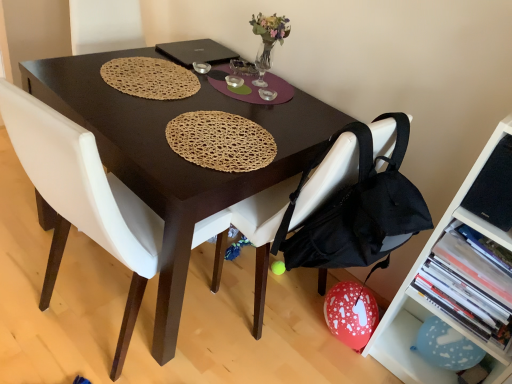
Where is `free region under white leather chair at center, which is the 2th chair in right-to-left order (from a real-world perspective)`? This screenshot has height=384, width=512. free region under white leather chair at center, which is the 2th chair in right-to-left order (from a real-world perspective) is located at coordinates click(91, 325).